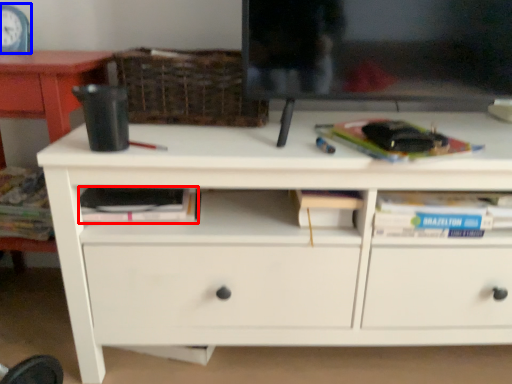
Question: Among these objects, which one is nearest to the camera, paperback book (highlighted by a red box) or clock (highlighted by a blue box)?

Choices:
 (A) paperback book
 (B) clock

Answer: (A)